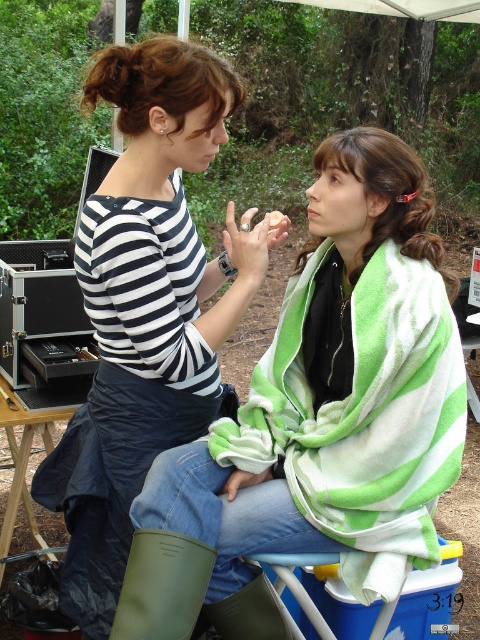
You are standing in the scene and want to place a small makeup kit on the green striped towel at center. What are the coordinates where you should place it?

The coordinates for the green striped towel at center are at point [321,410], so you should place the makeup kit there.

You are a photographer setting up for a photoshoot. You need to ensure that the green striped towel at center and the green rubber boot at lower left are both visible in the frame. Based on their sizes, which object will appear larger in the photo?

The green striped towel at center is taller than the green rubber boot at lower left, so it will appear larger in the photo.